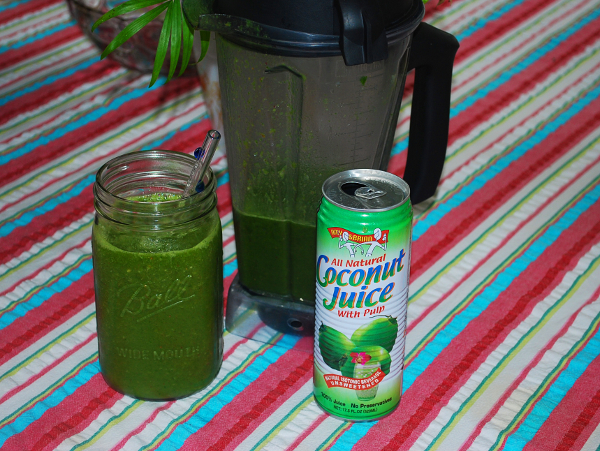
Locate an element on the screen. base of blender is located at coordinates (276, 312).